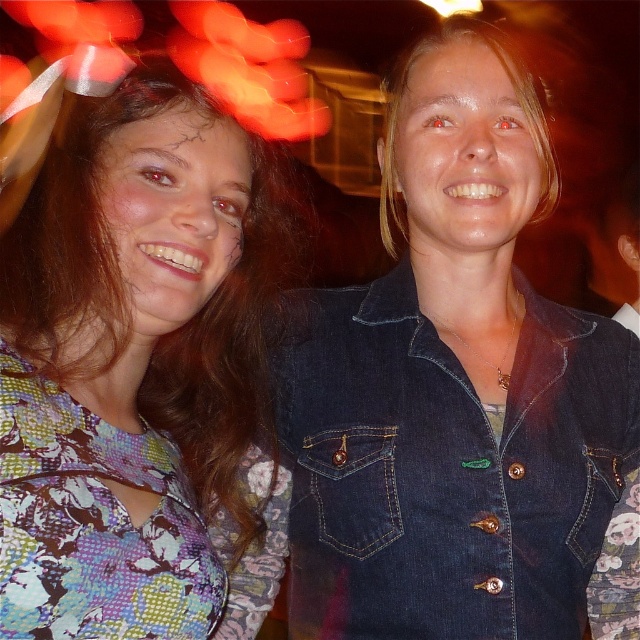
You are a photographer setting up a shoot. You need to ensure that the denim jacket at lower right and the floral fabric dress at left are both visible in the frame. Based on their widths, which one might require more space horizontally?

The denim jacket at lower right might be wider than the floral fabric dress at left, so it might require more horizontal space to ensure it is fully visible in the frame.

Based on the photo, you are a photographer trying to adjust the lighting for a photo shoot. You have a spotlight that can only illuminate objects on the right side of the floral fabric dress at left. Will the denim jacket at lower right be illuminated by this spotlight?

The denim jacket at lower right is positioned on the right side of the floral fabric dress at left, so it will be illuminated by the spotlight since it is on the right side of the dress.